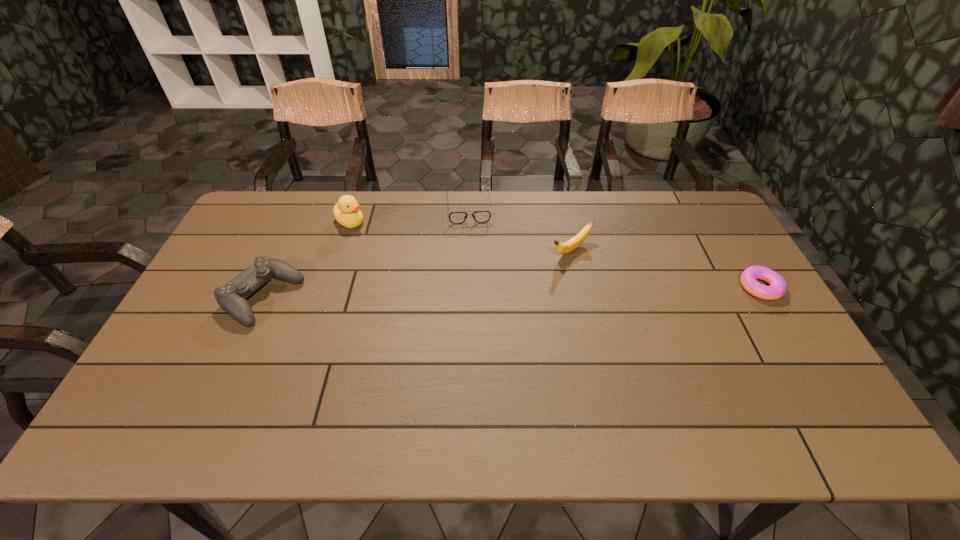
Identify the location of vacant space located 0.310m on the right of the leftmost object. (407, 298).

Locate an element on the screen. Image resolution: width=960 pixels, height=540 pixels. free point located on the back of the rightmost object is located at coordinates (706, 197).

Identify the location of free spot located at the stem of the fourth object from left to right. The image size is (960, 540). (538, 271).

Image resolution: width=960 pixels, height=540 pixels. I want to click on free space located at the stem of the fourth object from left to right, so coord(499,296).

Where is `free region located at the stem of the fourth object from left to right`? free region located at the stem of the fourth object from left to right is located at coordinates click(504, 293).

Where is `free region located on the front-facing side of the third object from right to left`? free region located on the front-facing side of the third object from right to left is located at coordinates (471, 238).

Where is `vacant position located 0.210m on the front-facing side of the third object from right to left`? Image resolution: width=960 pixels, height=540 pixels. vacant position located 0.210m on the front-facing side of the third object from right to left is located at coordinates (473, 268).

The image size is (960, 540). I want to click on vacant region located on the front-facing side of the third object from right to left, so click(472, 252).

The width and height of the screenshot is (960, 540). I want to click on vacant point located 0.050m on the face of the fourth object from right to left, so click(x=369, y=235).

What are the coordinates of `free location located 0.360m on the face of the fourth object from right to left` in the screenshot? It's located at (431, 282).